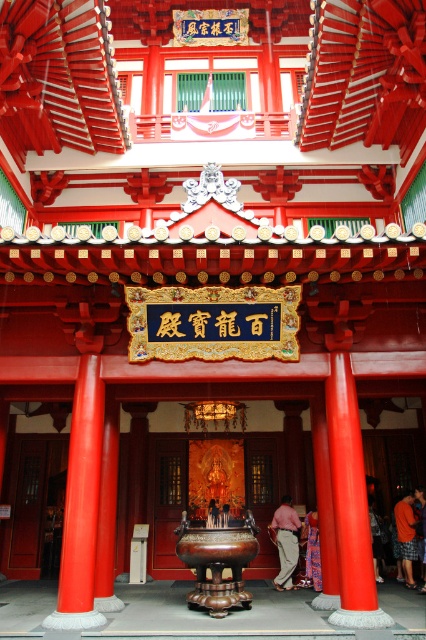
Which is more to the left, orange cotton shorts at lower right or silky purple robe at center?

Positioned to the left is silky purple robe at center.

Identify the location of orange cotton shorts at lower right. The height and width of the screenshot is (640, 426). (406, 536).

Can you confirm if pink fabric pants at center is positioned below orange fabric pants at center?

Yes.

Is pink fabric pants at center bigger than orange fabric pants at center?

Yes.

Is point (288, 552) closer to viewer compared to point (417, 500)?

Yes, point (288, 552) is closer to viewer.

Where is `pink fabric pants at center`? pink fabric pants at center is located at coordinates (285, 541).

Is orange cotton shorts at lower right positioned behind orange fabric pants at center?

No.

Can you confirm if orange cotton shorts at lower right is smaller than orange fabric pants at center?

No.

Between point (412, 550) and point (417, 493), which one is positioned behind?

Positioned behind is point (417, 493).

Where is `orange cotton shorts at lower right`? Image resolution: width=426 pixels, height=640 pixels. orange cotton shorts at lower right is located at coordinates (406, 536).